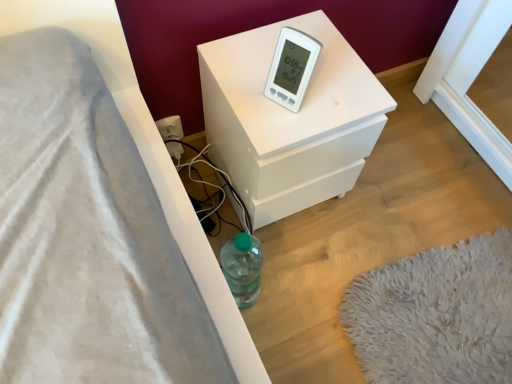
Identify the location of white plastic thermometer at upper center. The image size is (512, 384). pyautogui.click(x=291, y=68).

This screenshot has width=512, height=384. What do you see at coordinates (291, 68) in the screenshot?
I see `white plastic thermometer at upper center` at bounding box center [291, 68].

What do you see at coordinates (289, 119) in the screenshot? This screenshot has height=384, width=512. I see `white matte nightstand at center` at bounding box center [289, 119].

In order to face white matte nightstand at center, should I rotate leftwards or rightwards?

You should look right and rotate roughly 4.579 degrees.

Identify the location of white matte nightstand at center. (289, 119).

What is the approximate width of white matte nightstand at center?

12.03 inches.

Where is `white plastic thermometer at upper center`? Image resolution: width=512 pixels, height=384 pixels. white plastic thermometer at upper center is located at coordinates (291, 68).

Considering the relative positions of white matte nightstand at center and white plastic thermometer at upper center in the image provided, is white matte nightstand at center to the right of white plastic thermometer at upper center from the viewer's perspective?

Yes.

Between white matte nightstand at center and white plastic thermometer at upper center, which one is positioned behind?

white matte nightstand at center is further from the camera.

Between point (346, 42) and point (285, 38), which one is positioned behind?

The point (346, 42) is farther.

From the image's perspective, which is below, white matte nightstand at center or white plastic thermometer at upper center?

white matte nightstand at center.

From a real-world perspective, is white matte nightstand at center positioned above or below white plastic thermometer at upper center?

white matte nightstand at center is below white plastic thermometer at upper center.

Does white matte nightstand at center have a greater width compared to white plastic thermometer at upper center?

Yes, white matte nightstand at center is wider than white plastic thermometer at upper center.

In terms of height, does white matte nightstand at center look taller or shorter compared to white plastic thermometer at upper center?

In the image, white matte nightstand at center appears to be taller than white plastic thermometer at upper center.

Can you confirm if white matte nightstand at center is bigger than white plastic thermometer at upper center?

Yes, white matte nightstand at center is bigger than white plastic thermometer at upper center.

Is white matte nightstand at center not inside white plastic thermometer at upper center?

Yes, white matte nightstand at center is outside of white plastic thermometer at upper center.

Can you see white matte nightstand at center touching white plastic thermometer at upper center?

No, white matte nightstand at center is not beside white plastic thermometer at upper center.

Is white matte nightstand at center turned away from white plastic thermometer at upper center?

white matte nightstand at center is not turned away from white plastic thermometer at upper center.

What's the angular difference between white matte nightstand at center and white plastic thermometer at upper center's facing directions?

They differ by 66.4 degrees in their facing directions.

This screenshot has width=512, height=384. What are the coordinates of `thermometer located above the white matte nightstand at center (from a real-world perspective)` in the screenshot? It's located at (291, 68).

Which is more to the left, white plastic thermometer at upper center or white matte nightstand at center?

From the viewer's perspective, white plastic thermometer at upper center appears more on the left side.

Is white plastic thermometer at upper center further to the viewer compared to white matte nightstand at center?

No, white plastic thermometer at upper center is closer to the viewer.

Does point (300, 90) come behind point (243, 171)?

No.

From the image's perspective, which one is positioned lower, white plastic thermometer at upper center or white matte nightstand at center?

white matte nightstand at center.

From a real-world perspective, which is physically above, white plastic thermometer at upper center or white matte nightstand at center?

In real-world perspective, white plastic thermometer at upper center is above.

Which of these two, white plastic thermometer at upper center or white matte nightstand at center, is thinner?

With smaller width is white plastic thermometer at upper center.

Considering the sizes of objects white plastic thermometer at upper center and white matte nightstand at center in the image provided, who is shorter, white plastic thermometer at upper center or white matte nightstand at center?

white plastic thermometer at upper center is shorter.

Considering the sizes of white plastic thermometer at upper center and white matte nightstand at center in the image, is white plastic thermometer at upper center bigger or smaller than white matte nightstand at center?

Considering their sizes, white plastic thermometer at upper center takes up less space than white matte nightstand at center.

Is white plastic thermometer at upper center situated inside white matte nightstand at center or outside?

white plastic thermometer at upper center lies outside white matte nightstand at center.

Is there a large distance between white plastic thermometer at upper center and white matte nightstand at center?

white plastic thermometer at upper center is near white matte nightstand at center, not far away.

Is white plastic thermometer at upper center turned away from white matte nightstand at center?

No, white plastic thermometer at upper center's orientation is not away from white matte nightstand at center.

Locate an element on the screen. This screenshot has width=512, height=384. thermometer above the white matte nightstand at center (from the image's perspective) is located at coordinates (291, 68).

Find the location of a particular element. The height and width of the screenshot is (384, 512). thermometer that appears in front of the white matte nightstand at center is located at coordinates (291, 68).

I want to click on nightstand that appears below the white plastic thermometer at upper center (from a real-world perspective), so click(x=289, y=119).